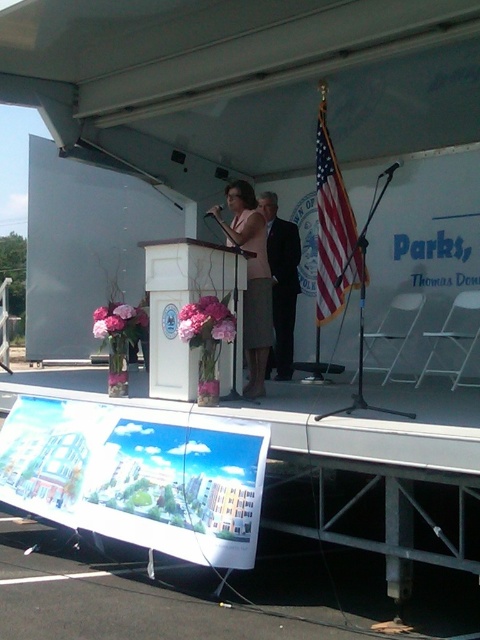
Between matte pink dress at center and black suit at center, which one appears on the left side from the viewer's perspective?

matte pink dress at center

Between matte pink dress at center and black suit at center, which one is positioned lower?

matte pink dress at center is below.

Locate an element on the screen. matte pink dress at center is located at coordinates (251, 280).

Where is `matte pink dress at center`? The width and height of the screenshot is (480, 640). matte pink dress at center is located at coordinates (251, 280).

Is american flag at center in front of black suit at center?

Yes.

Can you confirm if american flag at center is taller than black suit at center?

Indeed, american flag at center has a greater height compared to black suit at center.

Between point (340, 193) and point (273, 273), which one is positioned behind?

The point (273, 273) is more distant.

Image resolution: width=480 pixels, height=640 pixels. In order to click on american flag at center in this screenshot , I will do `click(334, 230)`.

This screenshot has height=640, width=480. What do you see at coordinates (334, 230) in the screenshot?
I see `american flag at center` at bounding box center [334, 230].

Does american flag at center have a smaller size compared to matte pink dress at center?

No.

Who is more distant from viewer, (321, 204) or (217, 205)?

The point (217, 205) is behind.

The image size is (480, 640). Identify the location of american flag at center. (334, 230).